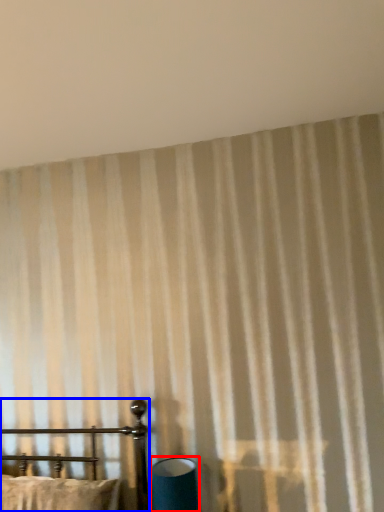
Question: Which object appears farthest to the camera in this image, table lamp (highlighted by a red box) or furniture (highlighted by a blue box)?

Choices:
 (A) table lamp
 (B) furniture

Answer: (A)